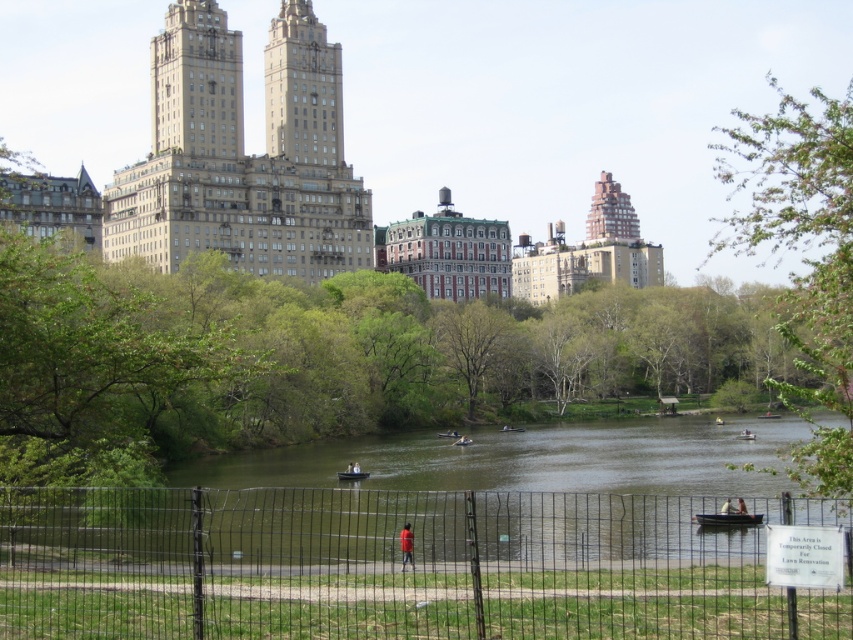
Does point (341, 472) come closer to viewer compared to point (467, 436)?

Yes, it is in front of point (467, 436).

Between wooden rowboat at center and wooden canoe at center, which one is positioned higher?

wooden canoe at center is higher up.

Is point (338, 477) positioned after point (456, 442)?

No, (338, 477) is in front of (456, 442).

At what (x,y) coordinates should I click in order to perform the action: click on wooden rowboat at center. Please return your answer as a coordinate pair (x, y). Looking at the image, I should click on click(352, 472).

Looking at this image, can you confirm if green leafy tree at center is taller than wooden canoe at center?

Correct, green leafy tree at center is much taller as wooden canoe at center.

Can you confirm if green leafy tree at center is bigger than wooden canoe at center?

Yes, green leafy tree at center is bigger than wooden canoe at center.

Find the location of `green leafy tree at center`. green leafy tree at center is located at coordinates (482, 348).

The height and width of the screenshot is (640, 853). Find the location of `green water at center`. green water at center is located at coordinates (532, 458).

Looking at this image, is green water at center below white plastic boat at center?

Indeed, green water at center is positioned under white plastic boat at center.

Is point (306, 481) less distant than point (741, 429)?

Yes, point (306, 481) is closer to viewer.

Locate an element on the screen. green water at center is located at coordinates (532, 458).